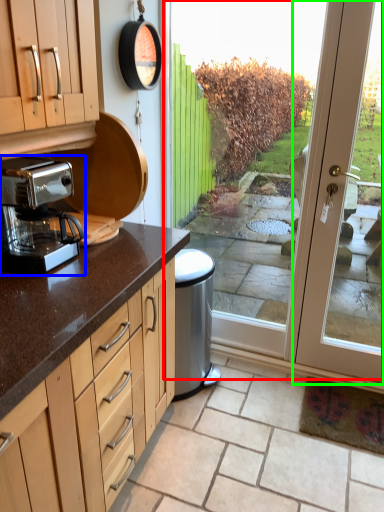
Question: Considering the real-world distances, which object is closest to screen door (highlighted by a red box)? coffee maker (highlighted by a blue box) or door (highlighted by a green box).

Choices:
 (A) coffee maker
 (B) door

Answer: (B)